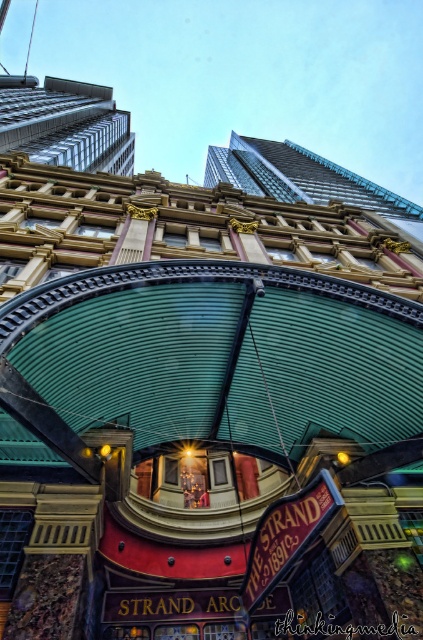
Question: Which point is farther from the camera taking this photo?

Choices:
 (A) (345, 168)
 (B) (125, 122)

Answer: (A)

Question: Considering the relative positions of glassy steel skyscraper at upper left and green corrugated metal canopy at upper center in the image provided, where is glassy steel skyscraper at upper left located with respect to green corrugated metal canopy at upper center?

Choices:
 (A) below
 (B) above

Answer: (B)

Question: From the image, what is the correct spatial relationship of glassy steel skyscraper at upper left in relation to green corrugated metal canopy at upper center?

Choices:
 (A) below
 (B) above

Answer: (B)

Question: Which point is closer to the camera?

Choices:
 (A) (285, 150)
 (B) (71, 100)

Answer: (B)

Question: From the image, what is the correct spatial relationship of glassy steel skyscraper at upper left in relation to green corrugated metal canopy at upper center?

Choices:
 (A) left
 (B) right

Answer: (A)